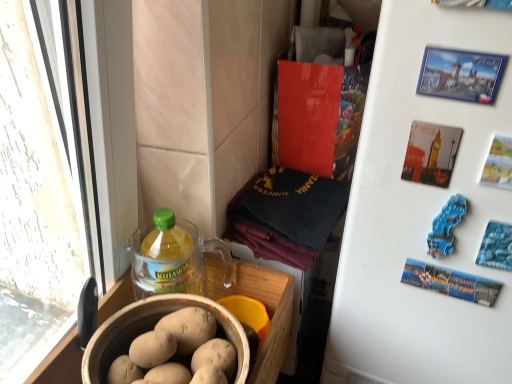
Where is `translucent plastic bottle at lower left`? The height and width of the screenshot is (384, 512). translucent plastic bottle at lower left is located at coordinates (167, 258).

Find the location of a particular element. blue plastic magnet at upper right is located at coordinates (446, 227).

Locate an element on the screen. Image resolution: width=512 pixels, height=384 pixels. translucent plastic bottle at lower left is located at coordinates (167, 258).

Are blue plastic magnet at upper right and white matte refrigerator at upper right making contact?

No, blue plastic magnet at upper right is not in contact with white matte refrigerator at upper right.

Which is closer, (433, 246) or (405, 235)?

Point (433, 246) appears to be closer to the viewer than point (405, 235).

What's the angular difference between blue plastic magnet at upper right and white matte refrigerator at upper right's facing directions?

There is a 7.07-degree angle between the facing directions of blue plastic magnet at upper right and white matte refrigerator at upper right.

Is matte brown bowl at lower left oriented towards blue plastic magnet at upper right?

No, matte brown bowl at lower left is not aimed at blue plastic magnet at upper right.

Considering the relative sizes of matte brown bowl at lower left and blue plastic magnet at upper right in the image provided, is matte brown bowl at lower left taller than blue plastic magnet at upper right?

No.

How many degrees apart are the facing directions of matte brown bowl at lower left and blue plastic magnet at upper right?

97.2 degrees separate the facing orientations of matte brown bowl at lower left and blue plastic magnet at upper right.

Which is nearer, (158, 312) or (442, 256)?

Positioned in front is point (442, 256).

Can you tell me how much matte brown bowl at lower left and white matte refrigerator at upper right differ in facing direction?

The facing directions of matte brown bowl at lower left and white matte refrigerator at upper right are 90.1 degrees apart.

Is matte brown bowl at lower left wider or thinner than white matte refrigerator at upper right?

matte brown bowl at lower left is thinner than white matte refrigerator at upper right.

Does matte brown bowl at lower left have a smaller size compared to white matte refrigerator at upper right?

Yes, matte brown bowl at lower left is smaller than white matte refrigerator at upper right.

Would you consider matte brown bowl at lower left to be distant from white matte refrigerator at upper right?

matte brown bowl at lower left is actually quite close to white matte refrigerator at upper right.

In terms of size, does translucent plastic bottle at lower left appear bigger or smaller than white matte refrigerator at upper right?

Considering their sizes, translucent plastic bottle at lower left takes up less space than white matte refrigerator at upper right.

Is translucent plastic bottle at lower left far away from white matte refrigerator at upper right?

No, translucent plastic bottle at lower left is in close proximity to white matte refrigerator at upper right.

Consider the image. What's the angular difference between translucent plastic bottle at lower left and white matte refrigerator at upper right's facing directions?

There is a 90.1-degree angle between the facing directions of translucent plastic bottle at lower left and white matte refrigerator at upper right.

Is translucent plastic bottle at lower left wider than white matte refrigerator at upper right?

In fact, translucent plastic bottle at lower left might be narrower than white matte refrigerator at upper right.

Is white matte refrigerator at upper right far away from blue plastic magnet at upper right?

No, there isn't a large distance between white matte refrigerator at upper right and blue plastic magnet at upper right.

Locate an element on the screen. This screenshot has width=512, height=384. refrigerator located on the right of blue plastic magnet at upper right is located at coordinates (421, 217).

Which object is positioned more to the left, white matte refrigerator at upper right or blue plastic magnet at upper right?

blue plastic magnet at upper right is more to the left.

From the image's perspective, which one is positioned lower, white matte refrigerator at upper right or blue plastic magnet at upper right?

white matte refrigerator at upper right appears lower in the image.

In the image, is translucent plastic bottle at lower left on the left side or the right side of matte brown bowl at lower left?

From the image, it's evident that translucent plastic bottle at lower left is to the left of matte brown bowl at lower left.

Can you confirm if translucent plastic bottle at lower left is smaller than matte brown bowl at lower left?

Correct, translucent plastic bottle at lower left occupies less space than matte brown bowl at lower left.

From the image's perspective, which object appears higher, translucent plastic bottle at lower left or matte brown bowl at lower left?

translucent plastic bottle at lower left, from the image's perspective.

Does point (173, 275) lie behind point (231, 332)?

Yes, point (173, 275) is farther from viewer.

Are translucent plastic bottle at lower left and blue plastic magnet at upper right beside each other?

No, translucent plastic bottle at lower left is not beside blue plastic magnet at upper right.

From a real-world perspective, who is located higher, translucent plastic bottle at lower left or blue plastic magnet at upper right?

blue plastic magnet at upper right.

From the image's perspective, who appears lower, translucent plastic bottle at lower left or blue plastic magnet at upper right?

translucent plastic bottle at lower left appears lower in the image.

Where is `refrigerator in front of the blue plastic magnet at upper right`? This screenshot has height=384, width=512. refrigerator in front of the blue plastic magnet at upper right is located at coordinates (421, 217).

Locate an element on the screen. The image size is (512, 384). food that is above the matte brown bowl at lower left (from the image's perspective) is located at coordinates (446, 227).

Considering their positions, is white matte refrigerator at upper right positioned further to translucent plastic bottle at lower left than matte brown bowl at lower left?

The object further to translucent plastic bottle at lower left is white matte refrigerator at upper right.

Which object lies further to the anchor point blue plastic magnet at upper right, matte brown bowl at lower left or white matte refrigerator at upper right?

The object further to blue plastic magnet at upper right is matte brown bowl at lower left.

From the image, which object appears to be nearer to matte brown bowl at lower left, translucent plastic bottle at lower left or blue plastic magnet at upper right?

translucent plastic bottle at lower left is positioned closer to the anchor matte brown bowl at lower left.

Considering their positions, is translucent plastic bottle at lower left positioned further to white matte refrigerator at upper right than blue plastic magnet at upper right?

Based on the image, translucent plastic bottle at lower left appears to be further to white matte refrigerator at upper right.

When comparing their distances from white matte refrigerator at upper right, does blue plastic magnet at upper right or matte brown bowl at lower left seem further?

matte brown bowl at lower left lies further to white matte refrigerator at upper right than the other object.

Which object lies further to the anchor point translucent plastic bottle at lower left, blue plastic magnet at upper right or matte brown bowl at lower left?

blue plastic magnet at upper right is positioned further to the anchor translucent plastic bottle at lower left.

From the image, which object appears to be farther from translucent plastic bottle at lower left, matte brown bowl at lower left or blue plastic magnet at upper right?

The object further to translucent plastic bottle at lower left is blue plastic magnet at upper right.

Considering their positions, is matte brown bowl at lower left positioned closer to white matte refrigerator at upper right than translucent plastic bottle at lower left?

matte brown bowl at lower left lies closer to white matte refrigerator at upper right than the other object.

You are a GUI agent. You are given a task and a screenshot of the screen. Output one action in this format:
    pyautogui.click(x=<x>, y=<y>)
    Task: Click on the food situated between translucent plastic bottle at lower left and white matte refrigerator at upper right from left to right
    The width and height of the screenshot is (512, 384).
    Given the screenshot: What is the action you would take?
    pyautogui.click(x=446, y=227)

What are the coordinates of `food located between matte brown bowl at lower left and white matte refrigerator at upper right in the left-right direction` in the screenshot? It's located at (446, 227).

Identify the location of bowl between translucent plastic bottle at lower left and white matte refrigerator at upper right. Image resolution: width=512 pixels, height=384 pixels. (151, 329).

This screenshot has height=384, width=512. I want to click on bowl between translucent plastic bottle at lower left and blue plastic magnet at upper right in the horizontal direction, so click(x=151, y=329).